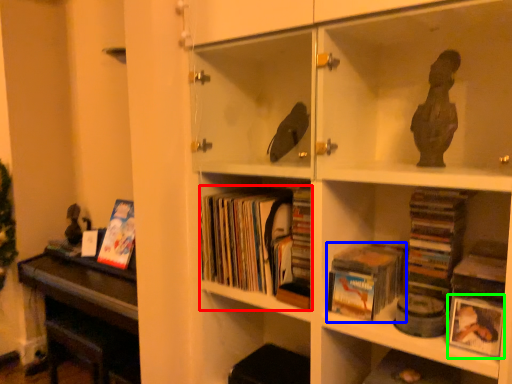
Question: Which object is the closest to the book (highlighted by a red box)? Choose among these: book (highlighted by a blue box) or paperback book (highlighted by a green box).

Choices:
 (A) book
 (B) paperback book

Answer: (A)